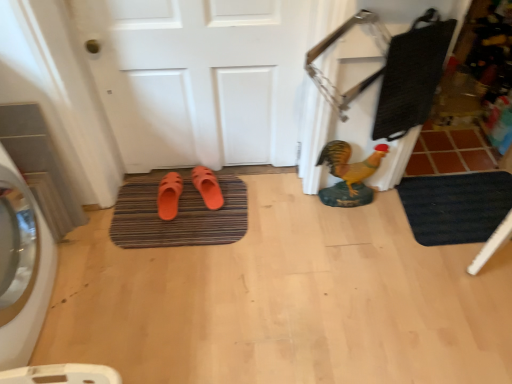
This screenshot has height=384, width=512. I want to click on vacant space that is in between yellow matte chicken at center-right and brown textured bath mat at center, marked as the first bath mat in a left-to-right arrangement, so click(x=280, y=208).